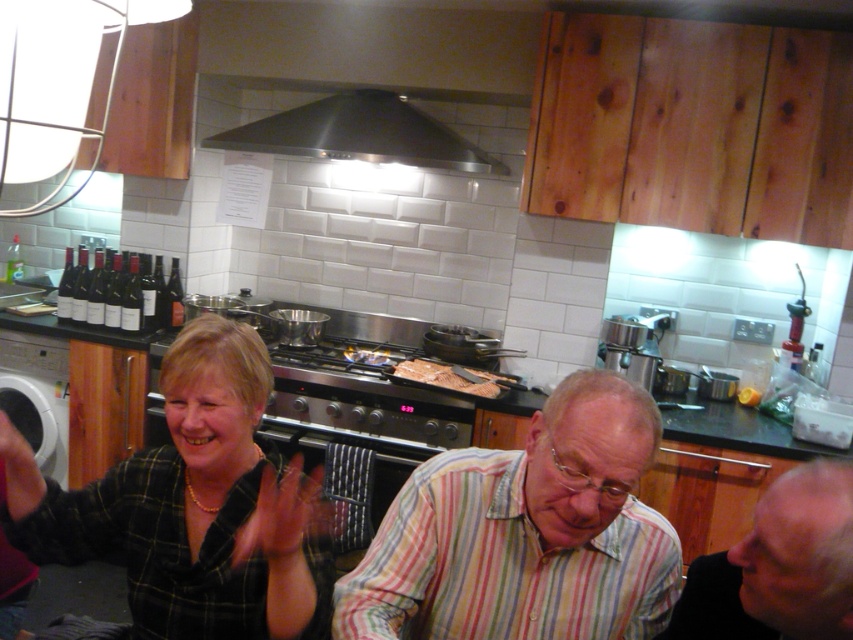
You are standing in the kitchen and want to locate the point at coordinates (360, 134). According to the scene description, where exactly is this point located?

The point at coordinates (360, 134) is located on the stainless steel exhaust hood at upper center.

You are a photographer setting up a shot in the kitchen scene. You want to capture both the striped cotton shirt at center and the striped cotton shirt at lower right in the frame. Which shirt should you focus on first to ensure both are in the frame?

The striped cotton shirt at center is positioned under the striped cotton shirt at lower right, so focusing on the striped cotton shirt at lower right first would allow you to include both shirts in the frame since the lower right shirt is above the center one.

Based on the coordinates provided, can you identify which object in the scene is positioned at point (x=525, y=532)?

The striped cotton shirt at center is located at point (x=525, y=532).